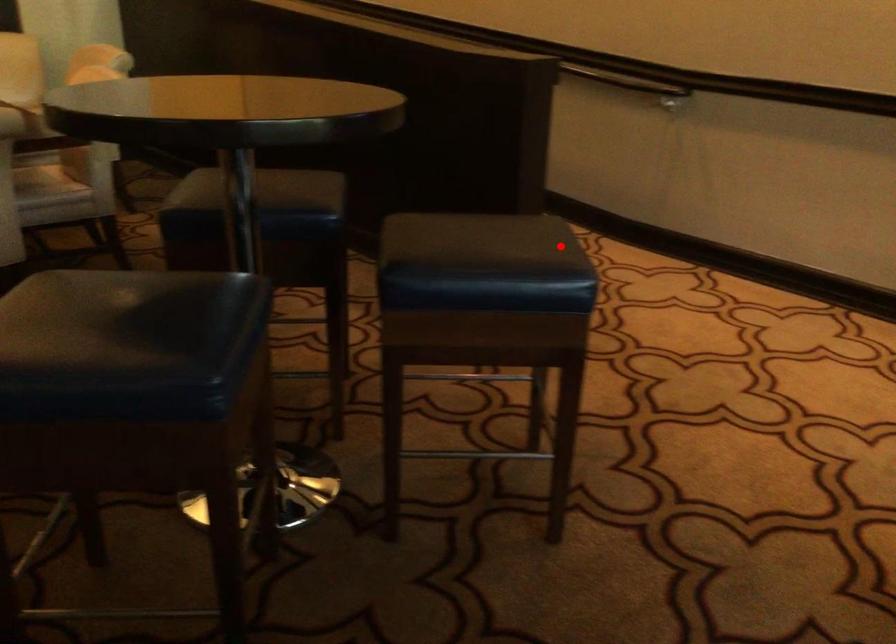
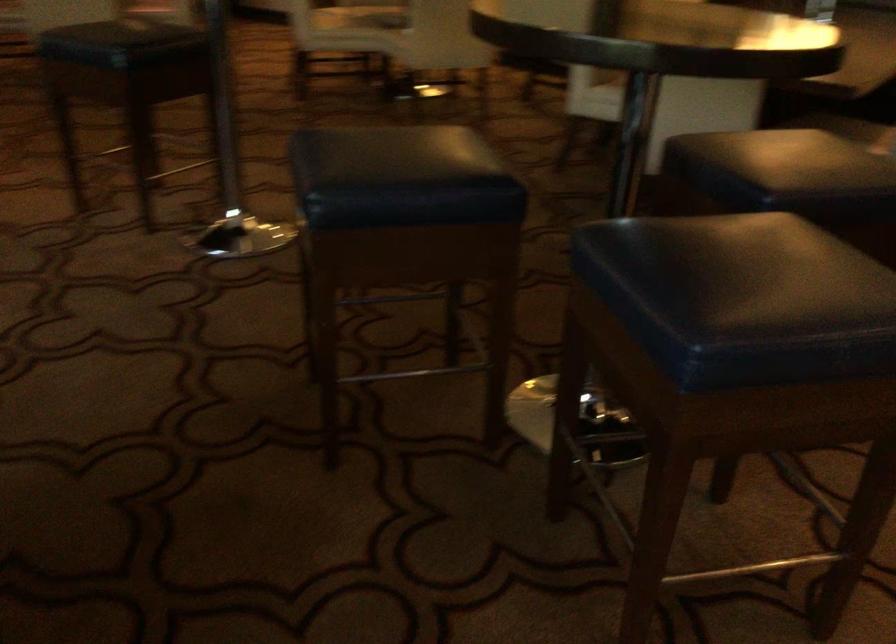
Question: I am providing you with two images of the same scene from different viewpoints. A red point is shown in image1. For the corresponding object point in image2, is it positioned nearer or farther from the camera?

Choices:
 (A) Nearer
 (B) Farther

Answer: (A)